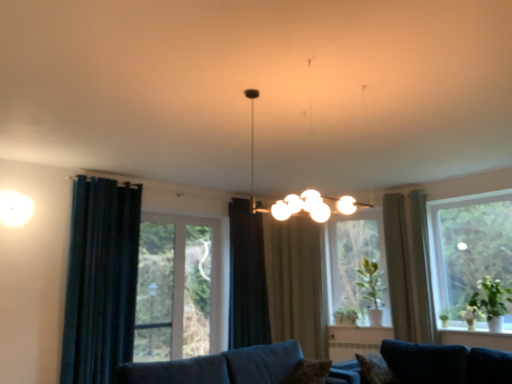
Locate an element on the screen. The width and height of the screenshot is (512, 384). silky beige curtain at right, arranged as the fourth curtain when viewed from the left is located at coordinates (399, 268).

In order to face green leafy plant at center, the 2th plant in the left-to-right sequence, should I rotate leftwards or rightwards?

To face it directly, rotate right by 15.248 degrees.

Where is `green leafy plant at center, acting as the 2th plant starting from the front`? The width and height of the screenshot is (512, 384). green leafy plant at center, acting as the 2th plant starting from the front is located at coordinates (369, 281).

Describe the element at coordinates (345, 317) in the screenshot. The image size is (512, 384). I see `green leafy plant at lower center, which ranks as the first plant in back-to-front order` at that location.

In order to face clear glass window at center, placed as the 1th window when sorted from left to right, should I rotate leftwards or rightwards?

Turn left approximately 12.574 degrees to face it.

Identify the location of brown textured pillow at lower right, arranged as the 1th pillow when viewed from the right. The image size is (512, 384). (375, 369).

Could you measure the distance between black fabric curtain at center, which ranks as the 4th curtain in right-to-left order, and clear glass window at center, which is the 2th window from right to left?

They are 3.92 feet apart.

Is black fabric curtain at center, which appears as the second curtain when viewed from the left, oriented towards clear glass window at center, positioned as the 2th window in left-to-right order?

No.

From the picture: Which object is positioned more to the right, black fabric curtain at center, which appears as the second curtain when viewed from the left, or clear glass window at center, which is the 2th window from right to left?

clear glass window at center, which is the 2th window from right to left, is more to the right.

Where is `curtain that is the 2nd one when counting leftward from the clear glass window at center, positioned as the 2th window in left-to-right order`? curtain that is the 2nd one when counting leftward from the clear glass window at center, positioned as the 2th window in left-to-right order is located at coordinates (247, 278).

Is point (470, 245) farther from camera compared to point (348, 323)?

No.

Is the surface of transparent glass window at right, the 3th window viewed from the left, in direct contact with green leafy plant at lower center, which ranks as the first plant in back-to-front order?

No, transparent glass window at right, the 3th window viewed from the left, is not beside green leafy plant at lower center, which ranks as the first plant in back-to-front order.

How many degrees apart are the facing directions of transparent glass window at right, placed as the 1th window when sorted from right to left, and green leafy plant at lower center, positioned as the 1th plant in left-to-right order?

28.3 degrees separate the facing orientations of transparent glass window at right, placed as the 1th window when sorted from right to left, and green leafy plant at lower center, positioned as the 1th plant in left-to-right order.

Considering their positions, is transparent glass window at right, placed as the 1th window when sorted from right to left, located in front of or behind green leafy plant at lower center, placed as the third plant when sorted from right to left?

transparent glass window at right, placed as the 1th window when sorted from right to left, is positioned closer to the viewer than green leafy plant at lower center, placed as the third plant when sorted from right to left.

From a real-world perspective, count 3rd plants upward from the velvet blue couch at lower center, which appears as the second studio couch when viewed from the left, and point to it. Please provide its 2D coordinates.

[(369, 281)]

Does green leafy plant at center, the 2th plant in the left-to-right sequence, have a greater height compared to velvet blue couch at lower center, the first studio couch positioned from the right?

Yes.

Is green leafy plant at right, the 3th plant when ordered from left to right, directly adjacent to brown textured pillow at lower right, arranged as the 1th pillow when viewed from the right?

No, green leafy plant at right, the 3th plant when ordered from left to right, is not making contact with brown textured pillow at lower right, arranged as the 1th pillow when viewed from the right.

Can you confirm if green leafy plant at right, marked as the first plant in a right-to-left arrangement, is shorter than brown textured pillow at lower right, arranged as the 1th pillow when viewed from the right?

No.

In the image, is green leafy plant at right, the 3th plant when ordered from left to right, positioned in front of or behind brown textured pillow at lower right, arranged as the 1th pillow when viewed from the right?

A: green leafy plant at right, the 3th plant when ordered from left to right, is positioned farther from the viewer than brown textured pillow at lower right, arranged as the 1th pillow when viewed from the right.

From the picture: Is green leafy plant at right, marked as the first plant in a right-to-left arrangement, aimed at brown textured pillow at lower right, placed as the 2th pillow when sorted from left to right?

No, green leafy plant at right, marked as the first plant in a right-to-left arrangement, is not oriented towards brown textured pillow at lower right, placed as the 2th pillow when sorted from left to right.

From a real-world perspective, which object stands above the other?

From a 3D spatial view, dark blue fabric curtain at left, acting as the fifth curtain starting from the right, is above.

Could you tell me if dark blue fabric curtain at left, which appears as the first curtain when viewed from the left, is turned towards green leafy plant at lower center, placed as the third plant when sorted from right to left?

No, dark blue fabric curtain at left, which appears as the first curtain when viewed from the left, is not facing towards green leafy plant at lower center, placed as the third plant when sorted from right to left.

From the image's perspective, between dark blue fabric curtain at left, acting as the fifth curtain starting from the right, and green leafy plant at lower center, the third plant from the front, which one is located above?

From the image's view, dark blue fabric curtain at left, acting as the fifth curtain starting from the right, is above.

This screenshot has height=384, width=512. There is a dark blue fabric curtain at left, acting as the fifth curtain starting from the right. Identify the location of the 3rd plant below it (from a real-world perspective). (345, 317).

Considering the relative sizes of beige fabric curtain at right, arranged as the 1th curtain when viewed from the right, and beige fabric curtain at center, which is the 3th curtain from right to left, in the image provided, is beige fabric curtain at right, arranged as the 1th curtain when viewed from the right, taller than beige fabric curtain at center, which is the 3th curtain from right to left,?

No.

How many degrees apart are the facing directions of beige fabric curtain at right, the fifth curtain when ordered from left to right, and beige fabric curtain at center, which is the 3th curtain from right to left?

33.4 degrees separate the facing orientations of beige fabric curtain at right, the fifth curtain when ordered from left to right, and beige fabric curtain at center, which is the 3th curtain from right to left.

Does beige fabric curtain at right, the fifth curtain when ordered from left to right, have a lesser width compared to beige fabric curtain at center, which is the 3th curtain in left-to-right order?

In fact, beige fabric curtain at right, the fifth curtain when ordered from left to right, might be wider than beige fabric curtain at center, which is the 3th curtain in left-to-right order.

From a real-world perspective, relative to clear glass window at center, the 3th window positioned from the right, is beige fabric curtain at center, which is the 3th curtain in left-to-right order, vertically above or below?

beige fabric curtain at center, which is the 3th curtain in left-to-right order, is situated higher than clear glass window at center, the 3th window positioned from the right, in the real world.

Considering the positions of objects beige fabric curtain at center, which is the 3th curtain from right to left, and clear glass window at center, placed as the 1th window when sorted from left to right, in the image provided, who is more to the right, beige fabric curtain at center, which is the 3th curtain from right to left, or clear glass window at center, placed as the 1th window when sorted from left to right,?

beige fabric curtain at center, which is the 3th curtain from right to left, is more to the right.

How many degrees apart are the facing directions of beige fabric curtain at center, which is the 3th curtain from right to left, and clear glass window at center, the 3th window positioned from the right?

They differ by 58.4 degrees in their facing directions.

Would you say beige fabric curtain at center, which is the 3th curtain in left-to-right order, is a long distance from clear glass window at center, placed as the 1th window when sorted from left to right?

Yes, beige fabric curtain at center, which is the 3th curtain in left-to-right order, is far from clear glass window at center, placed as the 1th window when sorted from left to right.

Where is `the 2nd window above the black fabric curtain at center, which ranks as the 4th curtain in right-to-left order (from a real-world perspective)`? This screenshot has width=512, height=384. the 2nd window above the black fabric curtain at center, which ranks as the 4th curtain in right-to-left order (from a real-world perspective) is located at coordinates (356, 261).

The height and width of the screenshot is (384, 512). In order to click on the 2nd window to the right of the green leafy plant at lower center, positioned as the 1th plant in left-to-right order, counting from the anchor's position in this screenshot , I will do `click(468, 249)`.

Based on their spatial positions, is velvet blue couch at lower center, the second studio couch when ordered from right to left, or brown textured pillow at lower center, which appears as the 1th pillow when viewed from the left, further from green leafy plant at center, the 2th plant in the left-to-right sequence?

velvet blue couch at lower center, the second studio couch when ordered from right to left, lies further to green leafy plant at center, the 2th plant in the left-to-right sequence, than the other object.

Considering their positions, is green leafy plant at center, acting as the 2th plant starting from the front, positioned closer to black fabric curtain at center, which appears as the second curtain when viewed from the left, than clear glass window at center, placed as the 1th window when sorted from left to right?

clear glass window at center, placed as the 1th window when sorted from left to right, is positioned closer to the anchor black fabric curtain at center, which appears as the second curtain when viewed from the left.

When comparing their distances from silky beige curtain at right, which appears as the 2th curtain when viewed from the right, does brown textured pillow at lower center, which appears as the 1th pillow when viewed from the left, or brown textured pillow at lower right, placed as the 2th pillow when sorted from left to right, seem further?

brown textured pillow at lower center, which appears as the 1th pillow when viewed from the left, is further to silky beige curtain at right, which appears as the 2th curtain when viewed from the right.

Estimate the real-world distances between objects in this image. Which object is further from beige fabric curtain at center, which is the 3th curtain from right to left, beige fabric curtain at right, the fifth curtain when ordered from left to right, or brown textured pillow at lower center, which appears as the 1th pillow when viewed from the left?

brown textured pillow at lower center, which appears as the 1th pillow when viewed from the left.

From the image, which object appears to be nearer to velvet blue couch at lower center, the second studio couch when ordered from right to left, brown textured pillow at lower center, which appears as the 1th pillow when viewed from the left, or transparent glass window at right, placed as the 1th window when sorted from right to left?

brown textured pillow at lower center, which appears as the 1th pillow when viewed from the left, is closer to velvet blue couch at lower center, the second studio couch when ordered from right to left.

Looking at the image, which one is located further to dark blue fabric curtain at left, acting as the fifth curtain starting from the right, green leafy plant at center, the 2th plant in the left-to-right sequence, or beige fabric curtain at center, which is the 3th curtain in left-to-right order?

green leafy plant at center, the 2th plant in the left-to-right sequence.

Based on their spatial positions, is silky beige curtain at right, arranged as the fourth curtain when viewed from the left, or brown textured pillow at lower right, arranged as the 1th pillow when viewed from the right, further from dark blue fabric curtain at left, which appears as the first curtain when viewed from the left?

The object further to dark blue fabric curtain at left, which appears as the first curtain when viewed from the left, is silky beige curtain at right, arranged as the fourth curtain when viewed from the left.

In the scene shown: Considering their positions, is clear glass window at center, which is the 2th window from right to left, positioned closer to velvet blue couch at lower center, which appears as the second studio couch when viewed from the left, than green leafy plant at center, acting as the 2th plant starting from the front?

Based on the image, clear glass window at center, which is the 2th window from right to left, appears to be nearer to velvet blue couch at lower center, which appears as the second studio couch when viewed from the left.

You are a GUI agent. You are given a task and a screenshot of the screen. Output one action in this format:
    pyautogui.click(x=<x>, y=<y>)
    Task: Click on the studio couch between black fabric curtain at center, which ranks as the 4th curtain in right-to-left order, and transparent glass window at right, placed as the 1th window when sorted from right to left
    The image size is (512, 384).
    Given the screenshot: What is the action you would take?
    pyautogui.click(x=446, y=363)

This screenshot has width=512, height=384. What are the coordinates of `studio couch located between velvet blue couch at lower center, the second studio couch when ordered from right to left, and green leafy plant at lower center, the third plant from the front, in the depth direction` in the screenshot? It's located at pyautogui.click(x=446, y=363).

Image resolution: width=512 pixels, height=384 pixels. I want to click on window between clear glass window at center, placed as the 1th window when sorted from left to right, and transparent glass window at right, placed as the 1th window when sorted from right to left, from left to right, so click(x=356, y=261).

Identify the location of window situated between clear glass window at center, the 3th window positioned from the right, and silky beige curtain at right, arranged as the fourth curtain when viewed from the left, from left to right. (356, 261).